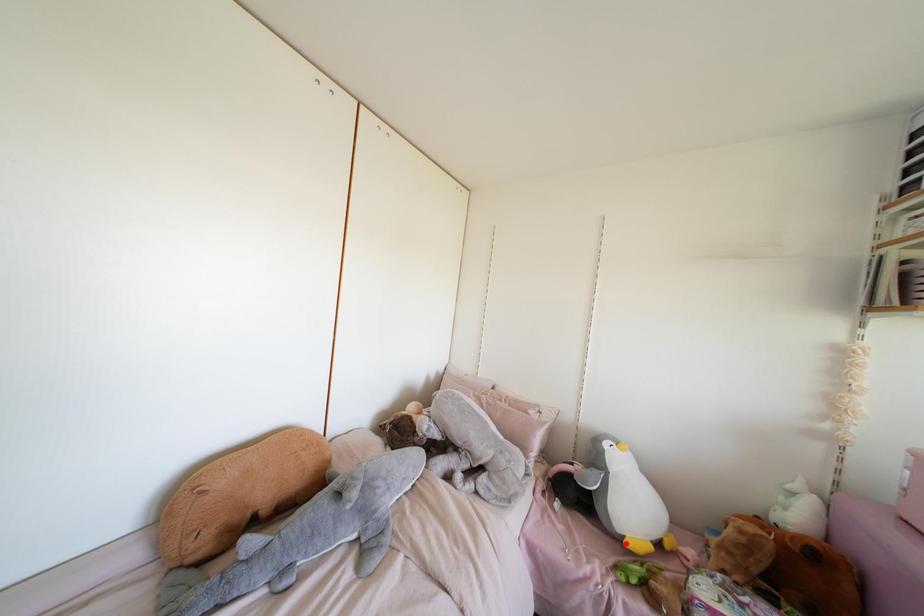
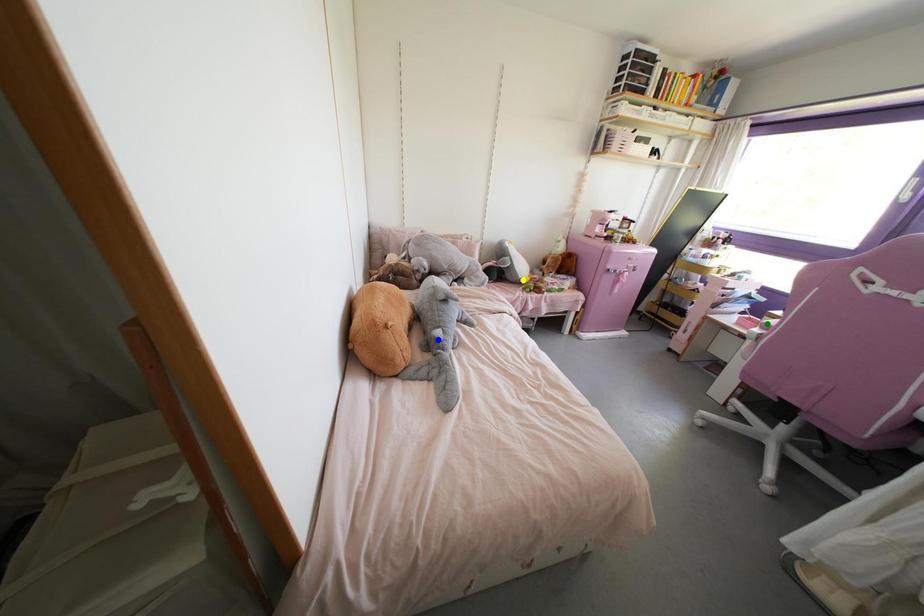
Question: I am providing you with two images of the same scene from different viewpoints. A red point is marked on the first image. You are given multiple points on the second image. Which spot in image 2 lines up with the point in image 1?

Choices:
 (A) yellow point
 (B) blue point
 (C) green point

Answer: (A)